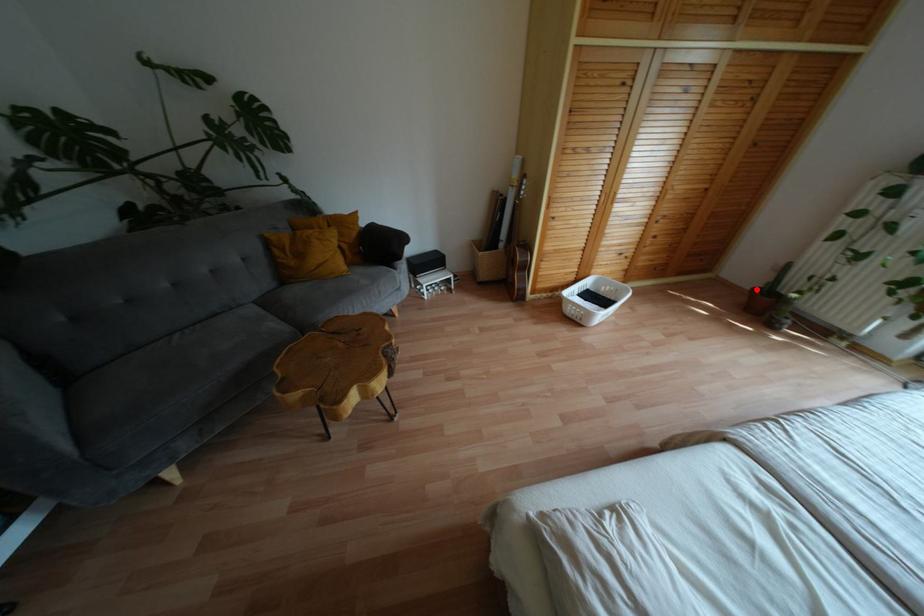
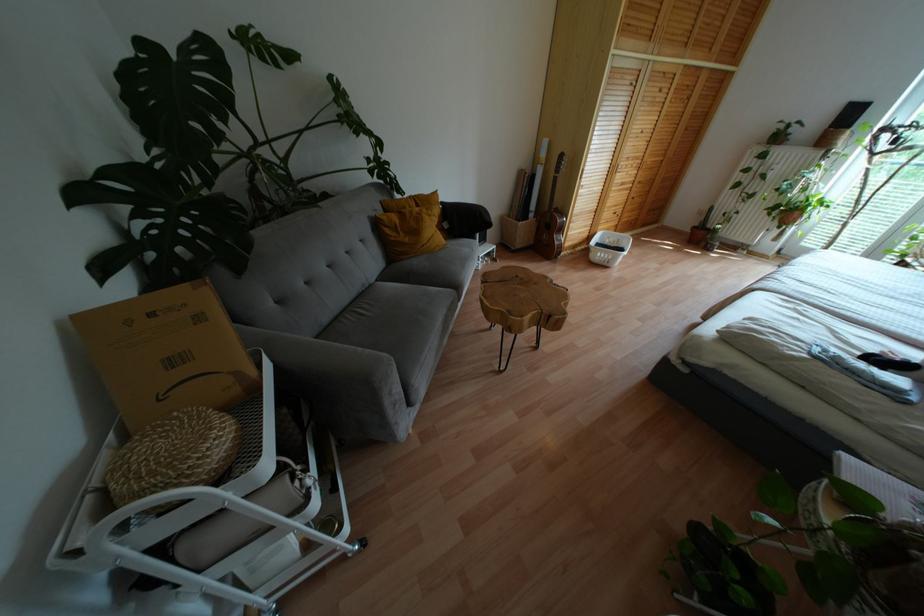
Question: I am providing you with two images of the same scene from different viewpoints. A red point is shown in image1. For the corresponding object point in image2, is it positioned nearer or farther from the camera?

Choices:
 (A) Nearer
 (B) Farther

Answer: (A)